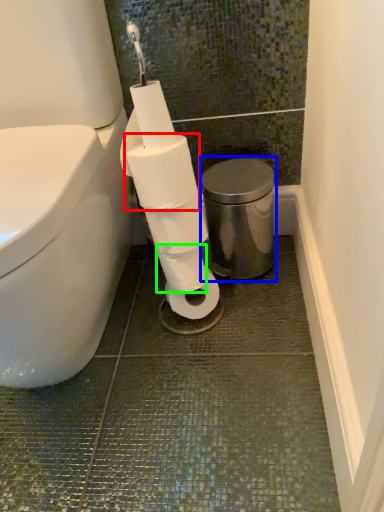
Question: Considering the real-world distances, which object is closest to toilet paper (highlighted by a red box)? bidet (highlighted by a blue box) or toilet paper (highlighted by a green box).

Choices:
 (A) bidet
 (B) toilet paper

Answer: (B)